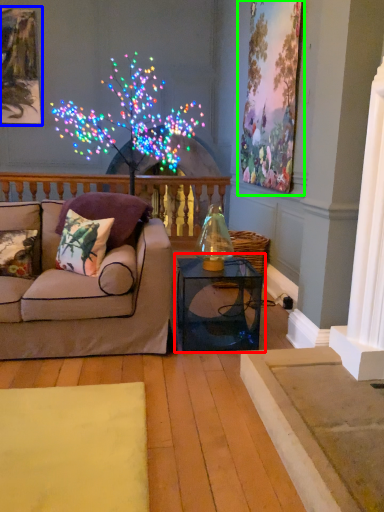
Question: Considering the real-world distances, which object is farthest from table (highlighted by a red box)? picture frame (highlighted by a blue box) or picture frame (highlighted by a green box)?

Choices:
 (A) picture frame
 (B) picture frame

Answer: (A)